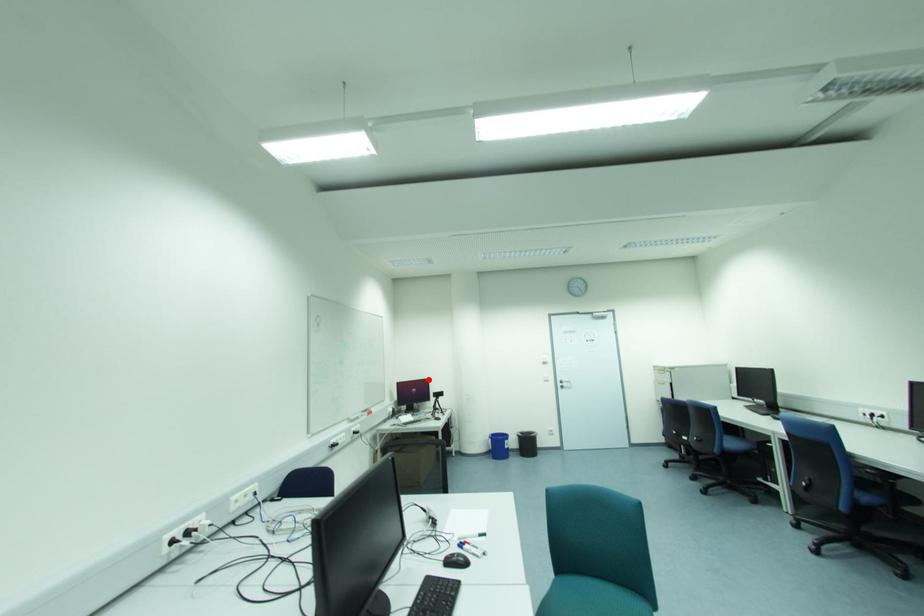
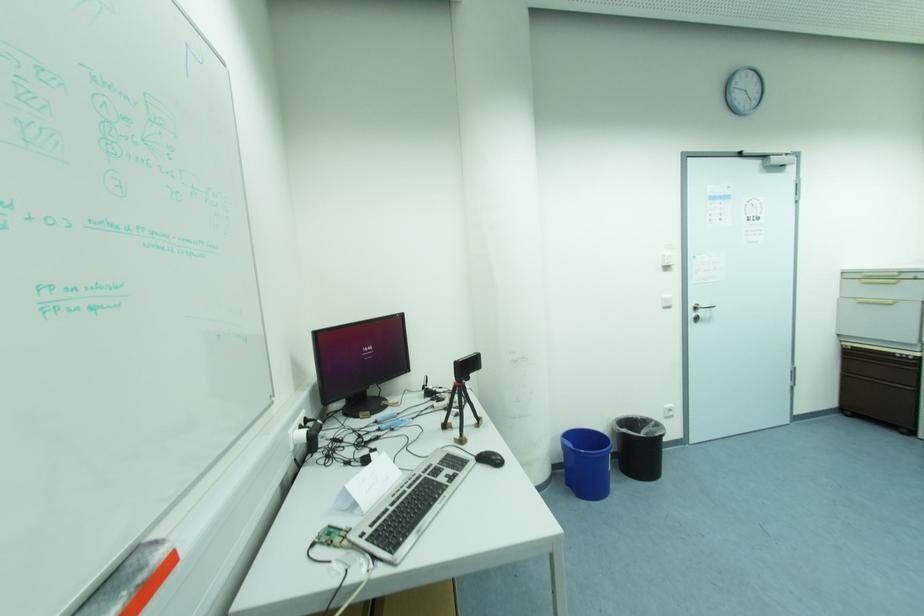
Find the pixel in the second image that matches the highlighted location in the first image.

(402, 317)